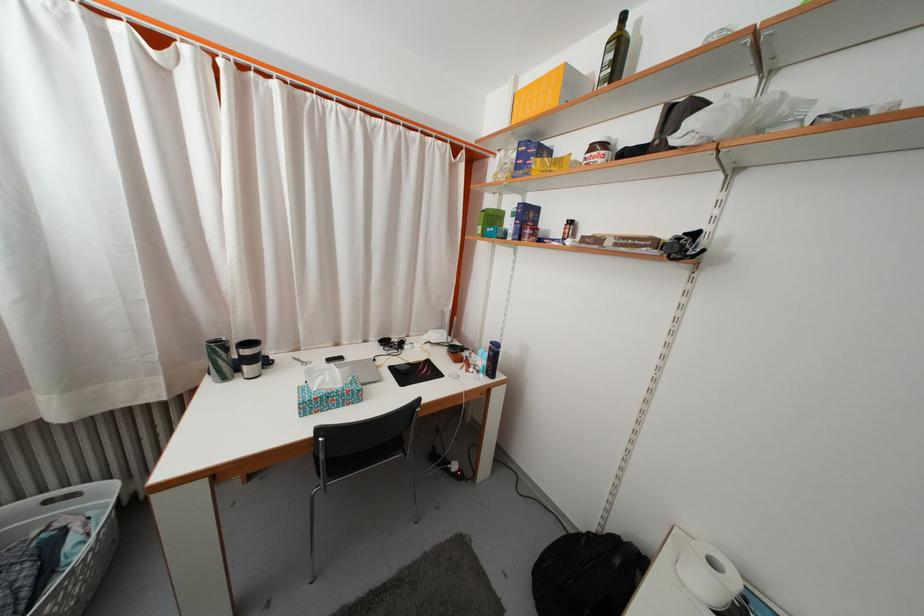
Where would you grasp the laundry basket handle? Please return your answer as a coordinate pair (x, y).

(61, 496)